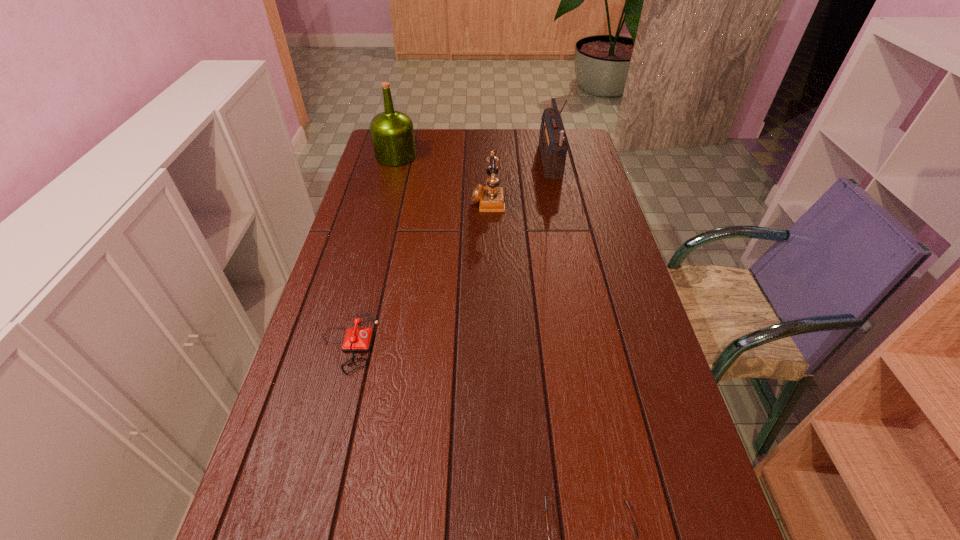
Where is `object positioned at the far right corner`? Image resolution: width=960 pixels, height=540 pixels. object positioned at the far right corner is located at coordinates (553, 143).

At what (x,y) coordinates should I click in order to perform the action: click on free space at the left edge of the desktop. Please return your answer as a coordinate pair (x, y). Looking at the image, I should click on (358, 355).

Where is `vacant space at the right edge`? The width and height of the screenshot is (960, 540). vacant space at the right edge is located at coordinates (585, 219).

Find the location of a particular element. The image size is (960, 540). free space between the second nearest object and the radio receiver is located at coordinates (449, 252).

Locate an element on the screen. free space between the left telephone and the tallest object is located at coordinates (449, 252).

At what (x,y) coordinates should I click in order to perform the action: click on free point between the fourth shortest object and the radio receiver. Please return your answer as a coordinate pair (x, y). The height and width of the screenshot is (540, 960). Looking at the image, I should click on (473, 159).

At what (x,y) coordinates should I click in order to perform the action: click on vacant space in between the fourth shortest object and the radio receiver. Please return your answer as a coordinate pair (x, y). This screenshot has height=540, width=960. Looking at the image, I should click on pos(473,159).

Locate an element on the screen. This screenshot has width=960, height=540. vacant region between the taller telephone and the left telephone is located at coordinates (418, 271).

Find the location of a particular element. Image resolution: width=960 pixels, height=540 pixels. vacant area that lies between the olive oil and the third tallest object is located at coordinates click(442, 177).

What are the coordinates of `vacant area that lies between the left telephone and the olive oil` in the screenshot? It's located at (372, 249).